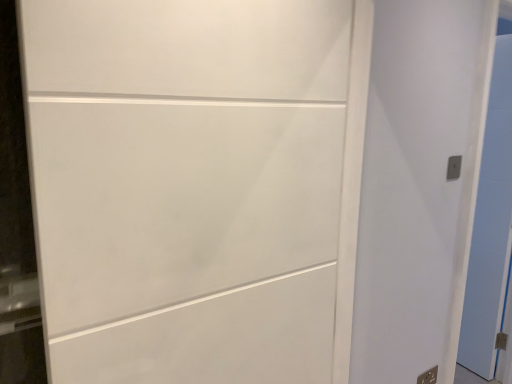
In the scene shown: What is the approximate width of metallic silver electric outlet at upper right, the first electric outlet positioned from the front?

1.32 centimeters.

This screenshot has width=512, height=384. In order to click on metallic silver outlet at lower right, arranged as the 2th electric outlet when viewed from the top in this screenshot , I will do `click(428, 376)`.

What do you see at coordinates (196, 185) in the screenshot?
I see `white matte door at center, placed as the first door when sorted from front to back` at bounding box center [196, 185].

Identify the location of white matte door at right, acting as the 2th door starting from the right. The image size is (512, 384). (419, 185).

Is metallic silver outlet at lower right, which appears as the second electric outlet when viewed from the front, thinner than white matte door at right, acting as the 2th door starting from the back?

Correct, the width of metallic silver outlet at lower right, which appears as the second electric outlet when viewed from the front, is less than that of white matte door at right, acting as the 2th door starting from the back.

From a real-world perspective, does metallic silver outlet at lower right, arranged as the 2th electric outlet when viewed from the top, stand above white matte door at right, acting as the 2th door starting from the right?

Incorrect, from a real-world perspective, metallic silver outlet at lower right, arranged as the 2th electric outlet when viewed from the top, is lower than white matte door at right, acting as the 2th door starting from the right.

Can we say metallic silver outlet at lower right, which is counted as the 1th electric outlet, starting from the back, lies outside white matte door at right, acting as the 2th door starting from the right?

Absolutely, metallic silver outlet at lower right, which is counted as the 1th electric outlet, starting from the back, is external to white matte door at right, acting as the 2th door starting from the right.

From the image's perspective, between metallic silver outlet at lower right, arranged as the 2th electric outlet when viewed from the top, and white matte door at right, acting as the 2th door starting from the right, who is located below?

From the image's view, metallic silver outlet at lower right, arranged as the 2th electric outlet when viewed from the top, is below.

Is metallic silver electric outlet at upper right, the first electric outlet positioned from the front, positioned with its back to metallic silver outlet at lower right, which is counted as the 1th electric outlet, starting from the back?

No.

Can you tell me how much metallic silver electric outlet at upper right, which is the 1th electric outlet from top to bottom, and metallic silver outlet at lower right, which is counted as the 1th electric outlet, starting from the bottom, differ in facing direction?

0.082 degrees separate the facing orientations of metallic silver electric outlet at upper right, which is the 1th electric outlet from top to bottom, and metallic silver outlet at lower right, which is counted as the 1th electric outlet, starting from the bottom.

Considering the relative sizes of metallic silver electric outlet at upper right, placed as the second electric outlet when sorted from bottom to top, and metallic silver outlet at lower right, which is counted as the 1th electric outlet, starting from the bottom, in the image provided, is metallic silver electric outlet at upper right, placed as the second electric outlet when sorted from bottom to top, thinner than metallic silver outlet at lower right, which is counted as the 1th electric outlet, starting from the bottom,?

Incorrect, the width of metallic silver electric outlet at upper right, placed as the second electric outlet when sorted from bottom to top, is not less than that of metallic silver outlet at lower right, which is counted as the 1th electric outlet, starting from the bottom.

Who is taller, metallic silver electric outlet at upper right, the first electric outlet positioned from the front, or metallic silver outlet at lower right, which is counted as the 1th electric outlet, starting from the bottom?

metallic silver outlet at lower right, which is counted as the 1th electric outlet, starting from the bottom, is taller.

Is white matte door at right, the second door when ordered from front to back, bigger or smaller than white matte door at center, the 1th door viewed from the left?

Clearly, white matte door at right, the second door when ordered from front to back, is smaller in size than white matte door at center, the 1th door viewed from the left.

Is white matte door at right, arranged as the second door when viewed from the left, wider or thinner than white matte door at center, placed as the first door when sorted from front to back?

Considering their sizes, white matte door at right, arranged as the second door when viewed from the left, looks broader than white matte door at center, placed as the first door when sorted from front to back.

From the image's perspective, which one is positioned lower, white matte door at right, acting as the 2th door starting from the back, or white matte door at center, the 3th door positioned from the right?

white matte door at right, acting as the 2th door starting from the back, is shown below in the image.

In terms of width, does metallic silver electric outlet at upper right, the first electric outlet positioned from the front, look wider or thinner when compared to white matte door at right, arranged as the second door when viewed from the left?

Clearly, metallic silver electric outlet at upper right, the first electric outlet positioned from the front, has less width compared to white matte door at right, arranged as the second door when viewed from the left.

From a real-world perspective, is metallic silver electric outlet at upper right, the first electric outlet positioned from the front, on top of white matte door at right, arranged as the second door when viewed from the left?

Indeed, from a real-world perspective, metallic silver electric outlet at upper right, the first electric outlet positioned from the front, stands above white matte door at right, arranged as the second door when viewed from the left.

Image resolution: width=512 pixels, height=384 pixels. Identify the location of the 1st door to the left of the metallic silver electric outlet at upper right, the first electric outlet positioned from the front, starting your count from the anchor. (419, 185).

Is there a large distance between metallic silver electric outlet at upper right, which is the second electric outlet from back to front, and white matte door at right, acting as the 2th door starting from the back?

They are positioned close to each other.

Is metallic silver electric outlet at upper right, placed as the second electric outlet when sorted from bottom to top, aimed at white glossy door at right, the third door positioned from the front?

No, metallic silver electric outlet at upper right, placed as the second electric outlet when sorted from bottom to top, does not turn towards white glossy door at right, the third door positioned from the front.

Does metallic silver electric outlet at upper right, which is the 1th electric outlet from top to bottom, have a lesser width compared to white glossy door at right, the 1th door when ordered from back to front?

Indeed, metallic silver electric outlet at upper right, which is the 1th electric outlet from top to bottom, has a lesser width compared to white glossy door at right, the 1th door when ordered from back to front.

Is the position of metallic silver electric outlet at upper right, which is the second electric outlet from back to front, less distant than that of white glossy door at right, the third door positioned from the front?

Yes, metallic silver electric outlet at upper right, which is the second electric outlet from back to front, is closer to the camera.

Is metallic silver electric outlet at upper right, which is the second electric outlet from back to front, bigger or smaller than white glossy door at right, which appears as the third door when viewed from the left?

Considering their sizes, metallic silver electric outlet at upper right, which is the second electric outlet from back to front, takes up less space than white glossy door at right, which appears as the third door when viewed from the left.

Between metallic silver outlet at lower right, which is counted as the 1th electric outlet, starting from the back, and white glossy door at right, the third door positioned from the front, which one has more height?

With more height is white glossy door at right, the third door positioned from the front.

How different are the orientations of metallic silver outlet at lower right, which appears as the second electric outlet when viewed from the front, and white glossy door at right, the third door positioned from the front, in degrees?

metallic silver outlet at lower right, which appears as the second electric outlet when viewed from the front, and white glossy door at right, the third door positioned from the front, are facing 97.8 degrees away from each other.

At what (x,y) coordinates should I click in order to perform the action: click on door behind the metallic silver outlet at lower right, which is counted as the 1th electric outlet, starting from the back. Please return your answer as a coordinate pair (x, y). This screenshot has height=384, width=512. Looking at the image, I should click on (490, 229).

From the image's perspective, is metallic silver outlet at lower right, arranged as the 2th electric outlet when viewed from the top, on white glossy door at right, the third door positioned from the front?

No, from the image's perspective, metallic silver outlet at lower right, arranged as the 2th electric outlet when viewed from the top, is not over white glossy door at right, the third door positioned from the front.

Is point (474, 295) closer to camera compared to point (380, 363)?

That is False.

From a real-world perspective, which object stands above the other?

From a 3D spatial view, white matte door at right, the second door when ordered from front to back, is above.

In the scene shown: Which object is positioned more to the right, white glossy door at right, which appears as the third door when viewed from the left, or white matte door at right, acting as the 2th door starting from the back?

white glossy door at right, which appears as the third door when viewed from the left, is more to the right.

Where is `electric outlet that is under the white matte door at right, acting as the 2th door starting from the back (from a real-world perspective)`? Image resolution: width=512 pixels, height=384 pixels. electric outlet that is under the white matte door at right, acting as the 2th door starting from the back (from a real-world perspective) is located at coordinates (428, 376).

Where is `electric outlet on the right of metallic silver outlet at lower right, which is counted as the 1th electric outlet, starting from the back`? electric outlet on the right of metallic silver outlet at lower right, which is counted as the 1th electric outlet, starting from the back is located at coordinates (454, 167).

Which object lies further to the anchor point metallic silver electric outlet at upper right, which is the 1th electric outlet from top to bottom, white glossy door at right, which appears as the third door when viewed from the left, or white matte door at center, placed as the first door when sorted from front to back?

Among the two, white matte door at center, placed as the first door when sorted from front to back, is located further to metallic silver electric outlet at upper right, which is the 1th electric outlet from top to bottom.

Which object lies nearer to the anchor point metallic silver outlet at lower right, which is counted as the 1th electric outlet, starting from the back, metallic silver electric outlet at upper right, which is the 1th electric outlet from top to bottom, or white matte door at center, the 1th door viewed from the left?

metallic silver electric outlet at upper right, which is the 1th electric outlet from top to bottom, is closer to metallic silver outlet at lower right, which is counted as the 1th electric outlet, starting from the back.

In the scene shown: Estimate the real-world distances between objects in this image. Which object is closer to white matte door at right, the second door when ordered from front to back, metallic silver outlet at lower right, which is counted as the 1th electric outlet, starting from the bottom, or white matte door at center, placed as the 3th door when sorted from back to front?

white matte door at center, placed as the 3th door when sorted from back to front.

Estimate the real-world distances between objects in this image. Which object is closer to white glossy door at right, which appears as the third door when viewed from the left, metallic silver electric outlet at upper right, placed as the second electric outlet when sorted from bottom to top, or white matte door at right, arranged as the second door when viewed from the left?

white matte door at right, arranged as the second door when viewed from the left, is positioned closer to the anchor white glossy door at right, which appears as the third door when viewed from the left.

Looking at the image, which one is located further to white matte door at center, the 3th door positioned from the right, white matte door at right, arranged as the second door when viewed from the left, or metallic silver electric outlet at upper right, the first electric outlet positioned from the front?

metallic silver electric outlet at upper right, the first electric outlet positioned from the front, is positioned further to the anchor white matte door at center, the 3th door positioned from the right.

Estimate the real-world distances between objects in this image. Which object is further from white glossy door at right, the 1th door when ordered from back to front, metallic silver outlet at lower right, which appears as the second electric outlet when viewed from the front, or metallic silver electric outlet at upper right, which is the 1th electric outlet from top to bottom?

metallic silver outlet at lower right, which appears as the second electric outlet when viewed from the front, is further to white glossy door at right, the 1th door when ordered from back to front.

When comparing their distances from white matte door at center, placed as the 3th door when sorted from back to front, does metallic silver outlet at lower right, arranged as the 2th electric outlet when viewed from the top, or white glossy door at right, marked as the first door in a right-to-left arrangement, seem closer?

Based on the image, metallic silver outlet at lower right, arranged as the 2th electric outlet when viewed from the top, appears to be nearer to white matte door at center, placed as the 3th door when sorted from back to front.

Considering their positions, is white matte door at right, the second door when ordered from front to back, positioned further to metallic silver electric outlet at upper right, which is the 1th electric outlet from top to bottom, than white glossy door at right, which appears as the third door when viewed from the left?

white glossy door at right, which appears as the third door when viewed from the left, is positioned further to the anchor metallic silver electric outlet at upper right, which is the 1th electric outlet from top to bottom.

You are a GUI agent. You are given a task and a screenshot of the screen. Output one action in this format:
    pyautogui.click(x=<x>, y=<y>)
    Task: Click on the electric outlet positioned between white matte door at center, the 3th door positioned from the right, and metallic silver outlet at lower right, which is counted as the 1th electric outlet, starting from the bottom, from near to far
    This screenshot has height=384, width=512.
    Given the screenshot: What is the action you would take?
    pyautogui.click(x=454, y=167)

Where is `door between white matte door at center, the 3th door positioned from the right, and metallic silver electric outlet at upper right, placed as the second electric outlet when sorted from bottom to top, from front to back`? door between white matte door at center, the 3th door positioned from the right, and metallic silver electric outlet at upper right, placed as the second electric outlet when sorted from bottom to top, from front to back is located at coordinates (419, 185).

Find the location of a particular element. The image size is (512, 384). electric outlet located between white matte door at right, acting as the 2th door starting from the back, and metallic silver outlet at lower right, which is counted as the 1th electric outlet, starting from the back, in the depth direction is located at coordinates (454, 167).

Identify the location of door positioned between white matte door at center, placed as the 3th door when sorted from back to front, and metallic silver outlet at lower right, which appears as the second electric outlet when viewed from the front, from near to far. (419, 185).